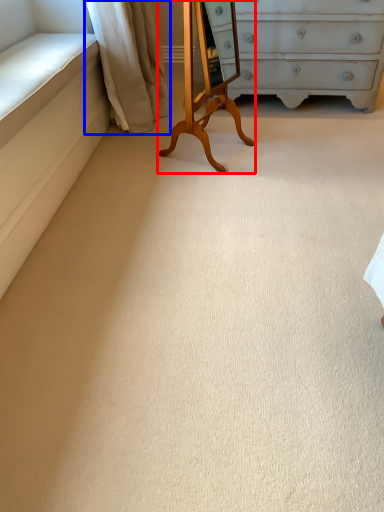
Question: Which object appears closest to the camera in this image, changing table (highlighted by a red box) or curtain (highlighted by a blue box)?

Choices:
 (A) changing table
 (B) curtain

Answer: (A)